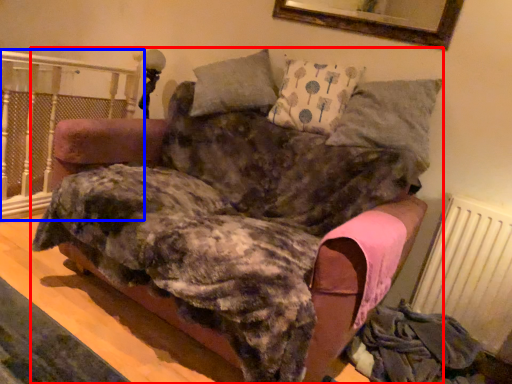
Question: Among these objects, which one is nearest to the camera, furniture (highlighted by a red box) or rail (highlighted by a blue box)?

Choices:
 (A) furniture
 (B) rail

Answer: (A)